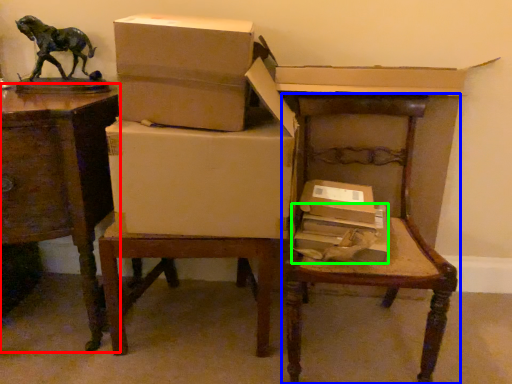
Question: Considering the real-world distances, which object is closest to table (highlighted by a red box)? chair (highlighted by a blue box) or box (highlighted by a green box).

Choices:
 (A) chair
 (B) box

Answer: (B)